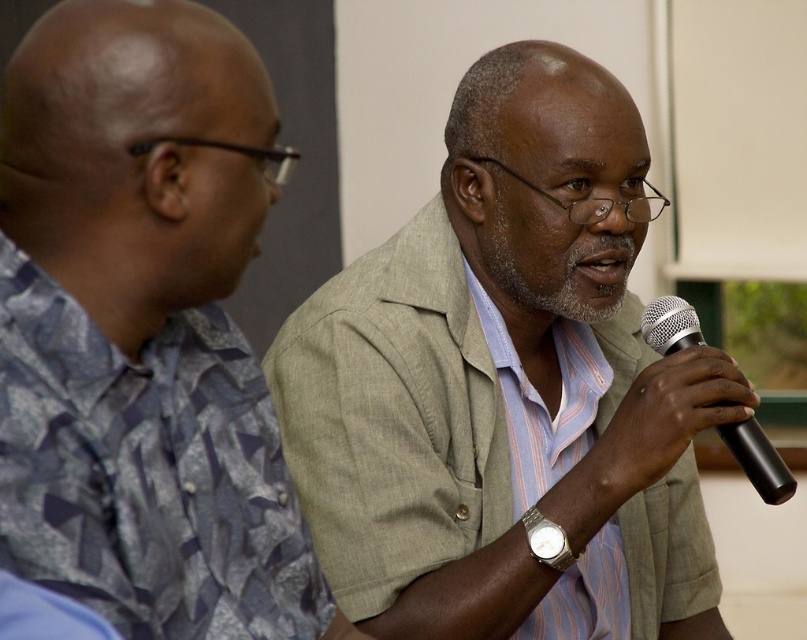
You are a photographer setting up a studio shoot. You need to adjust the lighting so that the light gray fabric shirt at center and the gray fabric shirt at upper right are both well lit. Given their sizes, which shirt requires a larger light source to ensure proper illumination?

The light gray fabric shirt at center requires a larger light source because it is much taller than the gray fabric shirt at upper right.

You are an event organizer who needs to set up a camera for a live stream. The camera is placed at the center of the room and can only focus on objects above it. Based on the scene, will the light gray fabric shirt at center and the black matte microphone at right both be in focus?

The light gray fabric shirt at center is located below the black matte microphone at right. Since the camera can only focus on objects above it, the black matte microphone at right will be in focus, but the light gray fabric shirt at center will not be in focus because it is positioned below the camera.

You are a photographer setting up for a group photo. You need to ensure that both the light gray fabric shirt at center and the black matte microphone at right are visible in the frame. Based on their positions, can you confirm if the microphone is blocking the view of the shirt?

The black matte microphone at right is behind the light gray fabric shirt at center, so the microphone is not blocking the view of the shirt as it is positioned behind it.